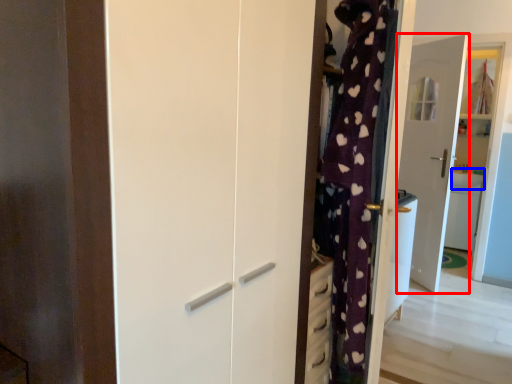
Question: Among these objects, which one is farthest to the camera, door (highlighted by a red box) or counter top (highlighted by a blue box)?

Choices:
 (A) door
 (B) counter top

Answer: (B)